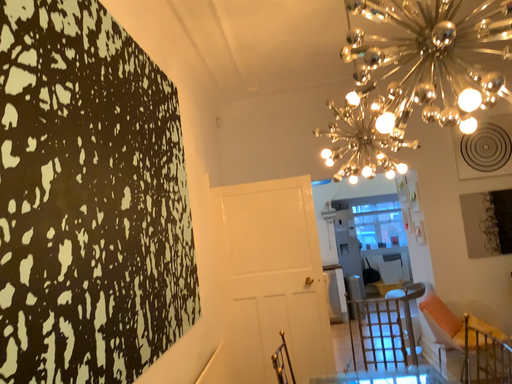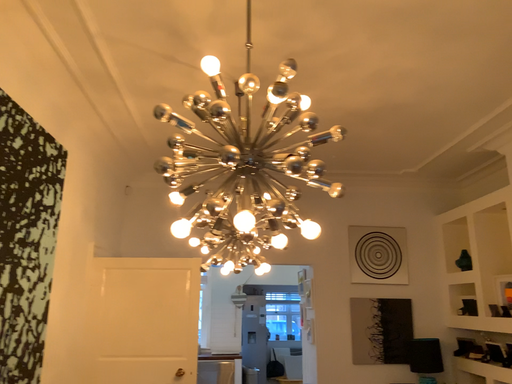
Question: How did the camera likely rotate when shooting the video?

Choices:
 (A) rotated downward
 (B) rotated upward

Answer: (B)